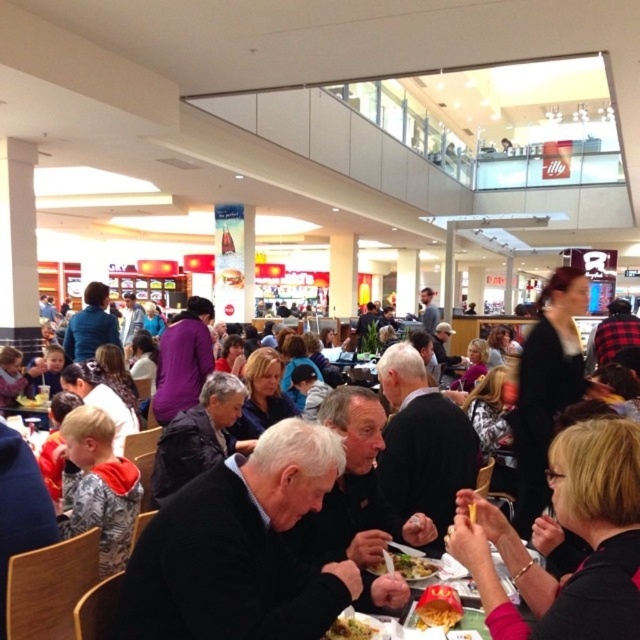
Does golden crispy fries at center appear under golden crispy fries at lower center?

Actually, golden crispy fries at center is above golden crispy fries at lower center.

Can you confirm if golden crispy fries at center is wider than golden crispy fries at lower center?

No.

Does point (419, 600) come behind point (362, 634)?

Yes, it is.

Find the location of a particular element. golden crispy fries at center is located at coordinates (436, 605).

Which is in front, point (257, 620) or point (419, 573)?

Point (257, 620)

The width and height of the screenshot is (640, 640). In order to click on dark gray sweater at center in this screenshot , I will do `click(241, 548)`.

In order to click on dark gray sweater at center in this screenshot , I will do `click(241, 548)`.

Is black textured sweater at lower right thinner than golden crispy fries at lower center?

Incorrect, black textured sweater at lower right's width is not less than golden crispy fries at lower center's.

Identify the location of black textured sweater at lower right. (573, 532).

The image size is (640, 640). Find the location of `black textured sweater at lower right`. black textured sweater at lower right is located at coordinates (573, 532).